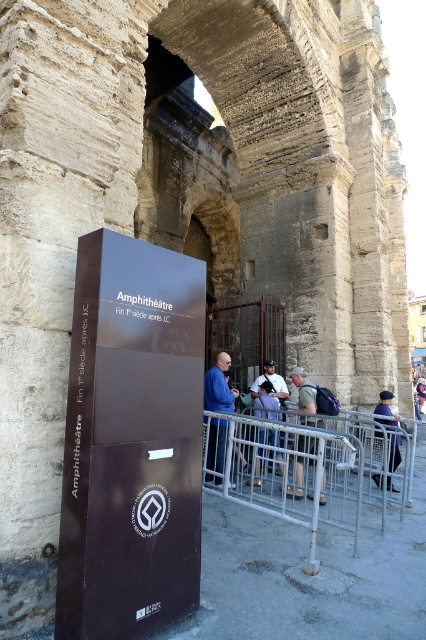
You are a tourist standing in front of the Arles Amphitheatre. You notice two shirts at the center of the scene. Which shirt is closer to you, the khaki cotton shirt at center or the white fabric shirt at center?

The khaki cotton shirt at center is closer to you because it is in front of the white fabric shirt at center.

In the scene shown: You are a tour guide leading a group at the Arles Amphitheatre. You notice a silver metallic rail at lower center and a khaki cotton shirt at center. Which object is wider?

The silver metallic rail at lower center is wider than the khaki cotton shirt at center.

You are a tourist standing in front of the Arles Amphitheatre and notice two shirts hanging on a rack near the dark brown informational sign. The shirts are labeled as khaki cotton shirt at center and white fabric shirt at center. Which shirt is closer to the ground?

The khaki cotton shirt at center is closer to the ground because it is positioned under the white fabric shirt at center.